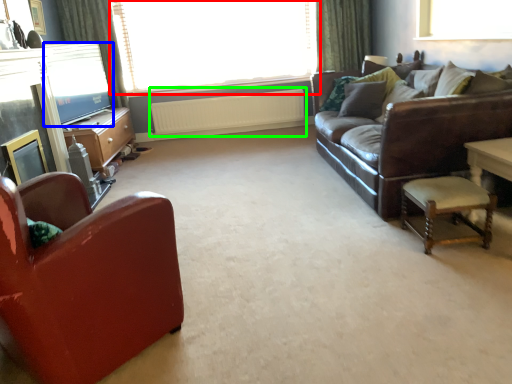
Question: Which object is positioned farthest from window (highlighted by a red box)? Select from window screen (highlighted by a blue box) and radiator (highlighted by a green box).

Choices:
 (A) window screen
 (B) radiator

Answer: (A)